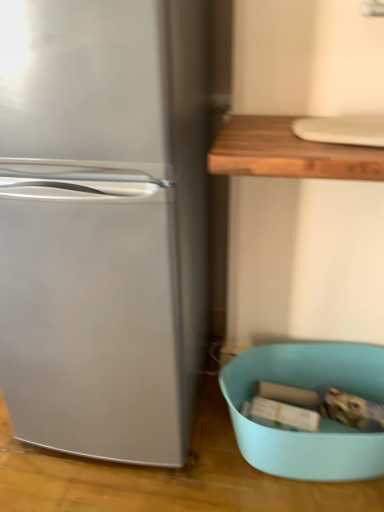
This screenshot has width=384, height=512. I want to click on teal plastic bowl at lower right, so click(321, 418).

This screenshot has height=512, width=384. What do you see at coordinates (321, 418) in the screenshot? I see `teal plastic bowl at lower right` at bounding box center [321, 418].

What do you see at coordinates (103, 224) in the screenshot? Image resolution: width=384 pixels, height=512 pixels. I see `satin silver refrigerator at left` at bounding box center [103, 224].

Image resolution: width=384 pixels, height=512 pixels. Find the location of `satin silver refrigerator at left`. satin silver refrigerator at left is located at coordinates (103, 224).

Identify the location of teal plastic bowl at lower right. The width and height of the screenshot is (384, 512). (321, 418).

Which object is positioned more to the left, satin silver refrigerator at left or teal plastic bowl at lower right?

Positioned to the left is satin silver refrigerator at left.

Relative to teal plastic bowl at lower right, is satin silver refrigerator at left in front or behind?

satin silver refrigerator at left is in front of teal plastic bowl at lower right.

Between point (139, 432) and point (343, 457), which one is positioned behind?

Point (139, 432)

From the image's perspective, is satin silver refrigerator at left over teal plastic bowl at lower right?

Indeed, from the image's perspective, satin silver refrigerator at left is shown above teal plastic bowl at lower right.

From a real-world perspective, is satin silver refrigerator at left above or below teal plastic bowl at lower right?

satin silver refrigerator at left is situated higher than teal plastic bowl at lower right in the real world.

Looking at this image, is satin silver refrigerator at left thinner than teal plastic bowl at lower right?

No, satin silver refrigerator at left is not thinner than teal plastic bowl at lower right.

Is satin silver refrigerator at left taller or shorter than teal plastic bowl at lower right?

satin silver refrigerator at left is taller than teal plastic bowl at lower right.

Does satin silver refrigerator at left have a larger size compared to teal plastic bowl at lower right?

Yes.

Could teal plastic bowl at lower right be considered to be inside satin silver refrigerator at left?

No, teal plastic bowl at lower right is not surrounded by satin silver refrigerator at left.

Looking at this image, are satin silver refrigerator at left and teal plastic bowl at lower right making contact?

No, satin silver refrigerator at left is not with teal plastic bowl at lower right.

Is satin silver refrigerator at left facing away from teal plastic bowl at lower right?

No, satin silver refrigerator at left's orientation is not away from teal plastic bowl at lower right.

This screenshot has height=512, width=384. Find the location of `mixing bowl behind the satin silver refrigerator at left`. mixing bowl behind the satin silver refrigerator at left is located at coordinates (321, 418).

Can you confirm if teal plastic bowl at lower right is positioned to the right of satin silver refrigerator at left?

Correct, you'll find teal plastic bowl at lower right to the right of satin silver refrigerator at left.

Is teal plastic bowl at lower right in front of or behind satin silver refrigerator at left in the image?

teal plastic bowl at lower right is behind satin silver refrigerator at left.

Which is nearer, (361, 364) or (135, 93)?

Point (361, 364) appears to be farther away from the viewer than point (135, 93).

From the image's perspective, is teal plastic bowl at lower right below satin silver refrigerator at left?

Yes, from the image's perspective, teal plastic bowl at lower right is beneath satin silver refrigerator at left.

From a real-world perspective, is teal plastic bowl at lower right positioned over satin silver refrigerator at left based on gravity?

No.

Looking at their sizes, would you say teal plastic bowl at lower right is wider or thinner than satin silver refrigerator at left?

In the image, teal plastic bowl at lower right appears to be more narrow than satin silver refrigerator at left.

Considering the relative sizes of teal plastic bowl at lower right and satin silver refrigerator at left in the image provided, is teal plastic bowl at lower right taller than satin silver refrigerator at left?

No, teal plastic bowl at lower right is not taller than satin silver refrigerator at left.

In terms of size, does teal plastic bowl at lower right appear bigger or smaller than satin silver refrigerator at left?

teal plastic bowl at lower right is smaller than satin silver refrigerator at left.

From the picture: Is satin silver refrigerator at left surrounded by teal plastic bowl at lower right?

No, satin silver refrigerator at left is not surrounded by teal plastic bowl at lower right.

Is there a large distance between teal plastic bowl at lower right and satin silver refrigerator at left?

Actually, teal plastic bowl at lower right and satin silver refrigerator at left are a little close together.

Is teal plastic bowl at lower right facing towards satin silver refrigerator at left?

No, teal plastic bowl at lower right does not turn towards satin silver refrigerator at left.

The height and width of the screenshot is (512, 384). What are the coordinates of `mixing bowl that is behind the satin silver refrigerator at left` in the screenshot? It's located at (321, 418).

Identify the location of mixing bowl lying behind the satin silver refrigerator at left. (321, 418).

Locate an element on the screen. Image resolution: width=384 pixels, height=512 pixels. refrigerator to the left of teal plastic bowl at lower right is located at coordinates (103, 224).